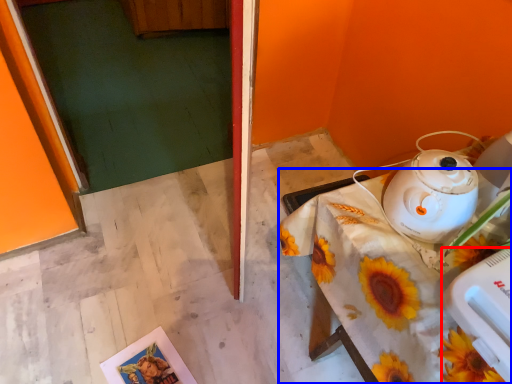
Question: Which object appears farthest to the camera in this image, appliance (highlighted by a red box) or table (highlighted by a blue box)?

Choices:
 (A) appliance
 (B) table

Answer: (B)